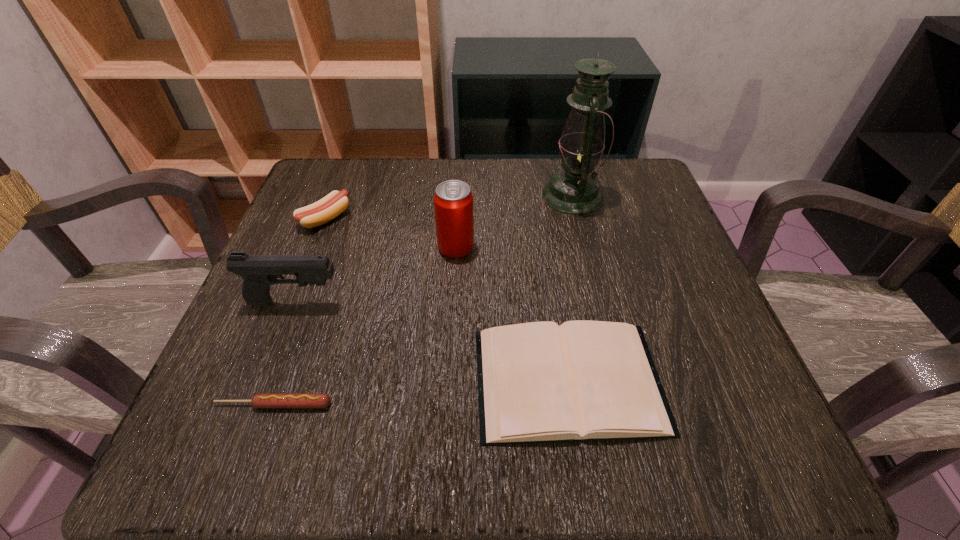
I want to click on blank space located 0.160m on the front of the tallest object, so click(591, 270).

Identify the location of blank area located 0.270m on the right of the fourth object from left to right. (611, 247).

Where is `vacant space situated 0.260m at the barrel of the third nearest object`? The width and height of the screenshot is (960, 540). vacant space situated 0.260m at the barrel of the third nearest object is located at coordinates pos(492,302).

Locate an element on the screen. This screenshot has width=960, height=540. vacant area located 0.220m on the right of the farther sausage is located at coordinates (453, 219).

Identify the location of vacant point located 0.280m on the left of the hardback book. The image size is (960, 540). (289, 380).

At what (x,y) coordinates should I click in order to perform the action: click on blank space located on the right of the shorter sausage. Please return your answer as a coordinate pair (x, y). Image resolution: width=960 pixels, height=540 pixels. Looking at the image, I should click on (421, 404).

This screenshot has height=540, width=960. What are the coordinates of `oil lamp present at the far edge` in the screenshot? It's located at (575, 189).

Image resolution: width=960 pixels, height=540 pixels. What are the coordinates of `sausage that is at the far edge` in the screenshot? It's located at (332, 205).

This screenshot has height=540, width=960. Identify the location of hardback book located in the near edge section of the desktop. (538, 382).

Where is `sausage located in the near edge section of the desktop`? The width and height of the screenshot is (960, 540). sausage located in the near edge section of the desktop is located at coordinates (262, 400).